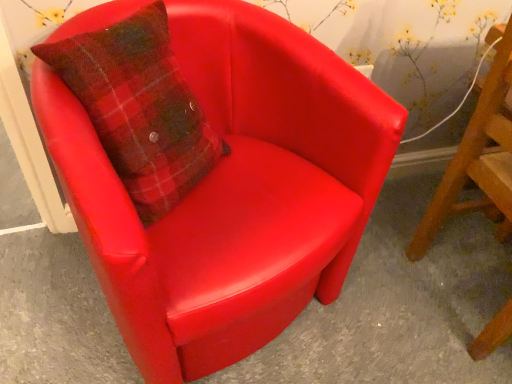
Question: Considering the positions of glossy leather chair at center and matte red chair at center, acting as the second chair starting from the left, in the image, is glossy leather chair at center wider or thinner than matte red chair at center, acting as the second chair starting from the left,?

Choices:
 (A) thin
 (B) wide

Answer: (B)

Question: From a real-world perspective, is glossy leather chair at center positioned above or below matte red chair at center, acting as the second chair starting from the left?

Choices:
 (A) below
 (B) above

Answer: (A)

Question: Estimate the real-world distances between objects in this image. Which object is closer to the matte red chair at center, acting as the second chair starting from the left?

Choices:
 (A) glossy leather chair at center
 (B) matte red armchair at center, which is the second chair in right-to-left order

Answer: (A)

Question: Which is nearer to the matte red chair at center, arranged as the 1th chair when viewed from the right?

Choices:
 (A) glossy leather chair at center
 (B) matte red armchair at center, which is the 1th chair in left-to-right order

Answer: (A)